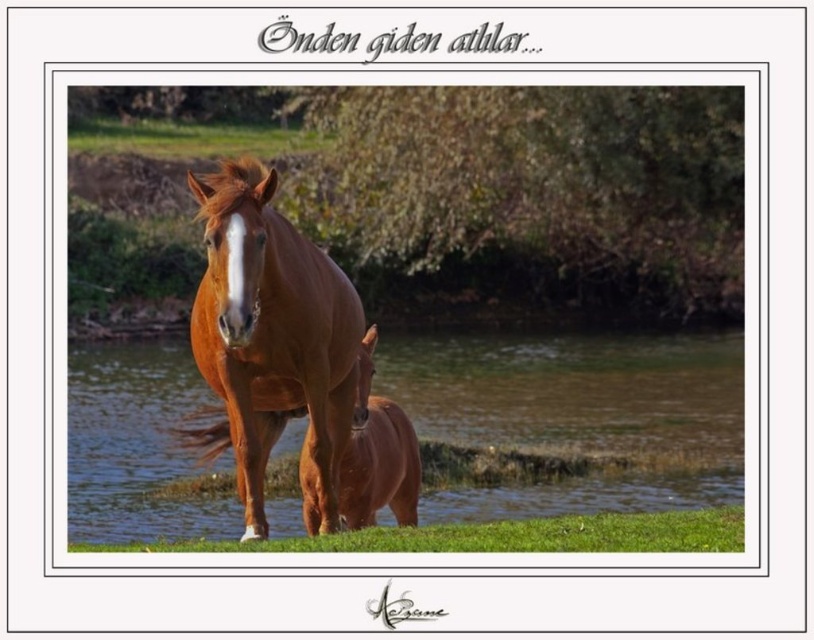
You are standing at the point with coordinates point (570, 420). Based on the scene description, what object are you currently standing on?

The point (570, 420) corresponds to brown glossy water at center, so you are standing on the brown glossy water at center.

You are standing in the rural setting where the two horses are located. You notice two points marked in the scene. The first point is at coordinates point (733, 336) and the second is at point (325, 465). If you want to reach the point that is closer to you, which coordinate should you head towards?

You should head towards point (325, 465) because it is closer to you than point (733, 336), which is further away.